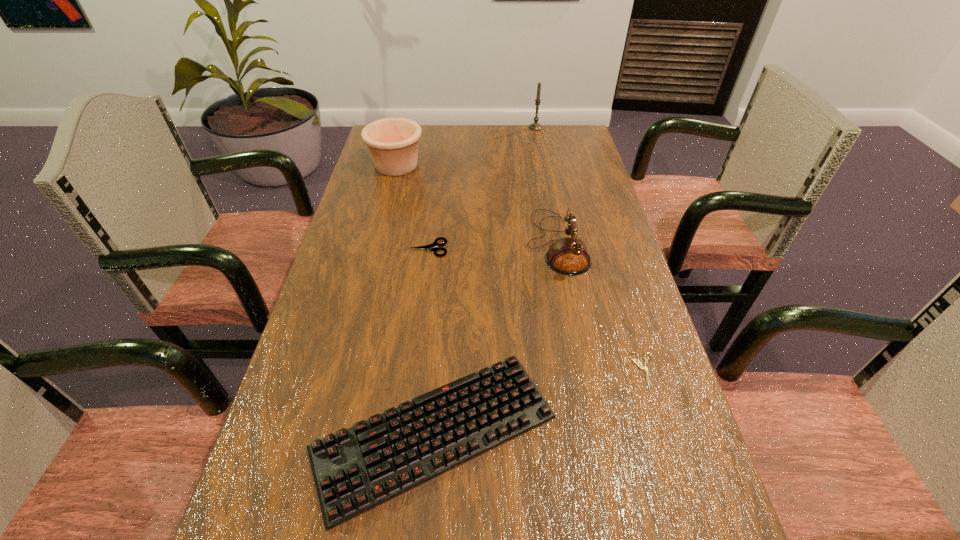
Identify the location of empty space between the candle and the computer keyboard. click(485, 280).

This screenshot has width=960, height=540. Find the location of `free space between the second shortest shears and the second farthest object`. free space between the second shortest shears and the second farthest object is located at coordinates (520, 268).

What are the coordinates of `vacant area that lies between the second farthest object and the computer keyboard` in the screenshot? It's located at (416, 299).

Locate an element on the screen. This screenshot has height=540, width=960. vacant space that is in between the tallest object and the fifth tallest object is located at coordinates (482, 188).

At what (x,y) coordinates should I click in order to perform the action: click on object that stands as the second closest to the leftmost shears. Please return your answer as a coordinate pair (x, y). Image resolution: width=960 pixels, height=540 pixels. Looking at the image, I should click on (392, 142).

Select which object is the third closest to the computer keyboard. Please provide its 2D coordinates. Your answer should be formatted as a tuple, i.e. [(x, y)], where the tuple contains the x and y coordinates of a point satisfying the conditions above.

[(569, 256)]

Select which shears appears as the third closest to the telephone. Please provide its 2D coordinates. Your answer should be formatted as a tuple, i.e. [(x, y)], where the tuple contains the x and y coordinates of a point satisfying the conditions above.

[(697, 539)]

This screenshot has height=540, width=960. I want to click on shears that stands as the closest to the third shortest object, so click(x=634, y=361).

The image size is (960, 540). In order to click on blank space that satisfies the following two spatial constraints: 1. on the back side of the farthest object; 2. on the right side of the sixth nearest object in this screenshot , I will do `click(406, 127)`.

Locate an element on the screen. This screenshot has width=960, height=540. free space that satisfies the following two spatial constraints: 1. on the rotary dial of the second nearest shears; 2. on the left side of the telephone is located at coordinates (581, 370).